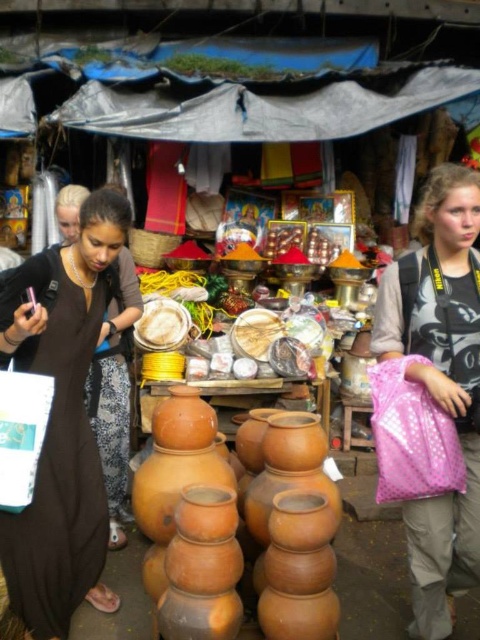
Question: Which point is closer to the camera taking this photo?

Choices:
 (A) (67, 337)
 (B) (448, 401)
 (C) (240, 436)

Answer: (B)

Question: Among these points, which one is nearest to the camera?

Choices:
 (A) (422, 531)
 (B) (330, 486)
 (C) (137, 337)
 (D) (36, 496)

Answer: (A)

Question: Is pink shiny bag at lower right to the left of matte clay pots at center from the viewer's perspective?

Choices:
 (A) no
 (B) yes

Answer: (A)

Question: Which object is the farthest from the white powder at center?

Choices:
 (A) matte black dress at center
 (B) pink shiny bag at lower right

Answer: (B)

Question: Can you confirm if matte black dress at center is smaller than matte clay pots at center?

Choices:
 (A) no
 (B) yes

Answer: (B)

Question: In this image, where is matte black dress at center located relative to pink shiny bag at lower right?

Choices:
 (A) above
 (B) below

Answer: (B)